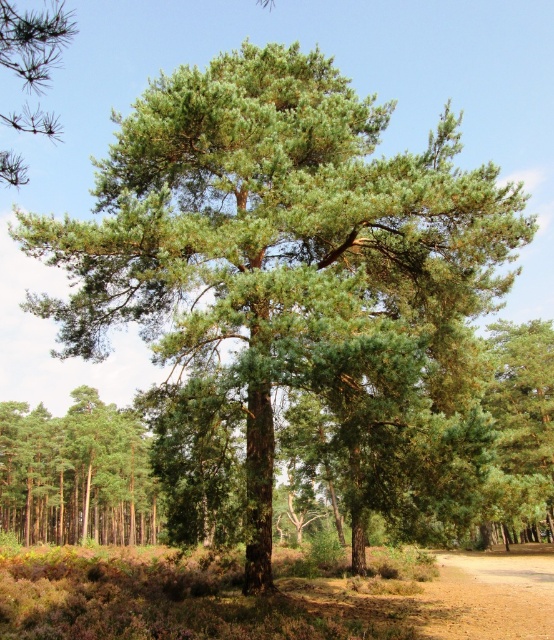
Question: Is dirt path at lower right to the right of green needle-like at upper left from the viewer's perspective?

Choices:
 (A) no
 (B) yes

Answer: (B)

Question: Which of the following is the farthest from the observer?

Choices:
 (A) (95, 419)
 (B) (519, 596)

Answer: (A)

Question: Can you confirm if green smooth tree at left is positioned to the right of dirt path at lower right?

Choices:
 (A) yes
 (B) no

Answer: (B)

Question: Which point is closer to the camera?

Choices:
 (A) (543, 604)
 (B) (84, 515)
 (C) (14, 45)

Answer: (C)

Question: Can you confirm if green smooth tree at left is smaller than green needle-like at upper left?

Choices:
 (A) yes
 (B) no

Answer: (A)

Question: Estimate the real-world distances between objects in this image. Which object is closer to the green smooth tree at left?

Choices:
 (A) green needle-like at upper left
 (B) dirt path at lower right

Answer: (B)